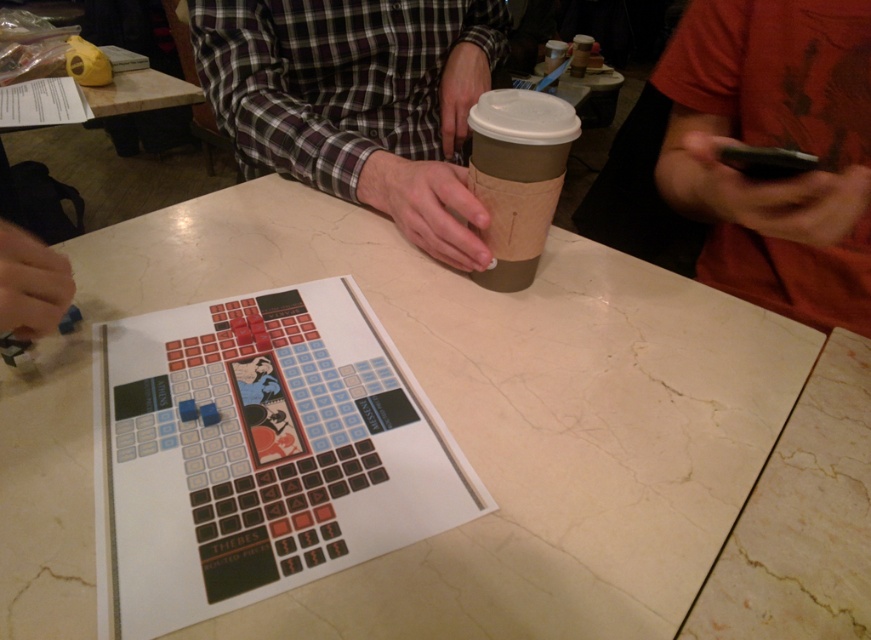
You are trying to place a large decorative plate on the table. The plate is as wide as the orange cotton shirt at upper right. Will it fit on the white marble table at center?

The white marble table at center is wider than the orange cotton shirt at upper right, so the plate will fit on the white marble table at center.

You are playing a board game on the table and need to move a piece from point (647,323) to point (349,200). Considering the spatial relationship between these two points, which direction should you move the piece to get closer to the destination?

You should move the piece upward and to the left because point (349,200) is located above and to the left of point (647,323).

You are a game player sitting at the white marble table at center. You want to pass your coffee cup to the person wearing the plaid shirt at center. Can you directly hand it to them without moving from your seat?

The white marble table at center is in front of the plaid shirt at center, so you can directly hand the coffee cup to the person wearing the plaid shirt at center by reaching across the table.